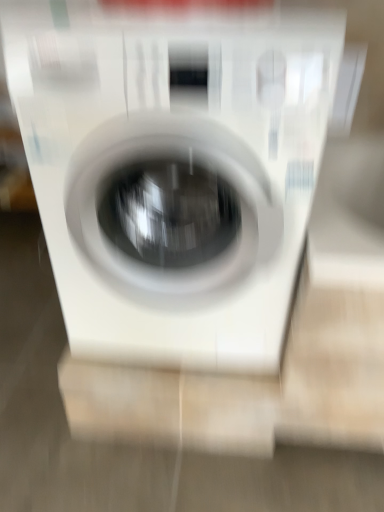
What do you see at coordinates (177, 170) in the screenshot? This screenshot has height=512, width=384. I see `white glossy washing machine at center` at bounding box center [177, 170].

Measure the distance between white glossy washing machine at center and camera.

The distance of white glossy washing machine at center from camera is 27.77 inches.

The width and height of the screenshot is (384, 512). In order to click on white glossy washing machine at center in this screenshot , I will do `click(177, 170)`.

Where is `white glossy washing machine at center`? white glossy washing machine at center is located at coordinates (177, 170).